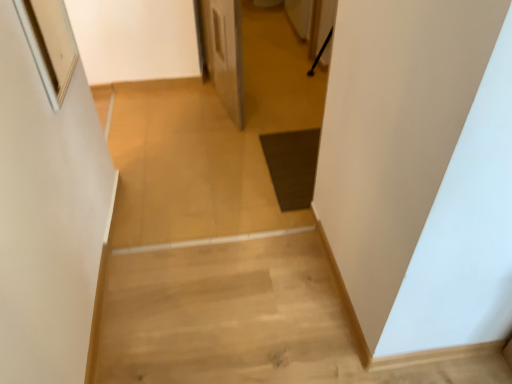
The height and width of the screenshot is (384, 512). Find the location of `free space in front of wooden door at center`. free space in front of wooden door at center is located at coordinates (217, 142).